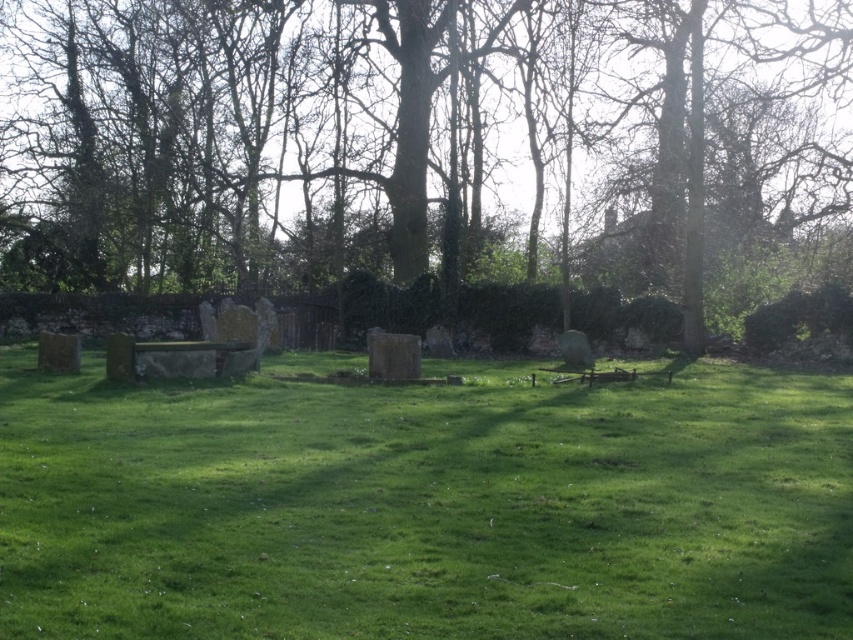
Can you confirm if green leafy tree at center is positioned to the left of green grassy field at center?

Indeed, green leafy tree at center is positioned on the left side of green grassy field at center.

Between point (561, 232) and point (54, 506), which one is positioned behind?

The point (561, 232) is behind.

Find the location of a particular element. green leafy tree at center is located at coordinates (416, 141).